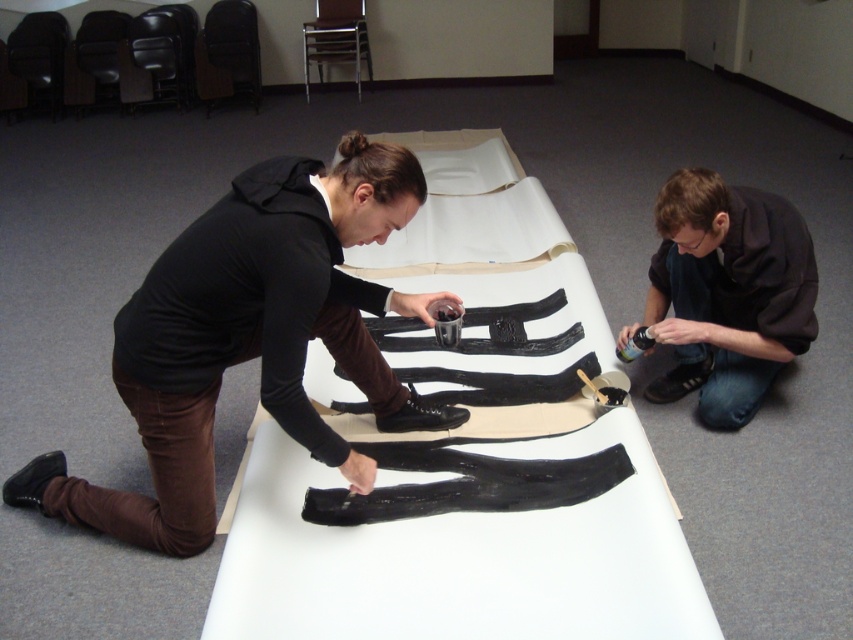
Is white paper at center wider than black matte shirt at lower right?

Correct, the width of white paper at center exceeds that of black matte shirt at lower right.

Can you confirm if white paper at center is thinner than black matte shirt at lower right?

In fact, white paper at center might be wider than black matte shirt at lower right.

What do you see at coordinates (457, 557) in the screenshot? This screenshot has width=853, height=640. I see `white paper at center` at bounding box center [457, 557].

Identify the location of white paper at center. (457, 557).

Does white paper at center appear on the left side of matte black shoes at center?

In fact, white paper at center is to the right of matte black shoes at center.

Is point (535, 561) behind point (320, 189)?

Yes, it is.

This screenshot has height=640, width=853. In order to click on white paper at center in this screenshot , I will do `click(457, 557)`.

Is matte black shoes at center below black matte shirt at lower right?

Yes, matte black shoes at center is below black matte shirt at lower right.

Is point (171, 244) positioned behind point (758, 333)?

No, (171, 244) is closer to viewer.

Is point (184, 259) behind point (769, 298)?

No, it is in front of (769, 298).

Find the location of `matte black shoes at center`. matte black shoes at center is located at coordinates (250, 339).